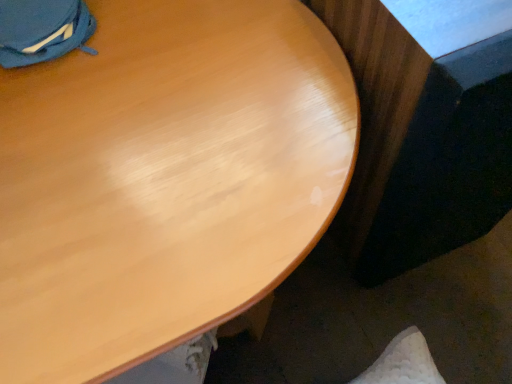
What is the approximate width of glossy wood desk at upper center?

The width of glossy wood desk at upper center is 24.34 inches.

Measure the distance between glossy wood desk at upper center and camera.

glossy wood desk at upper center and camera are 15.24 inches apart.

The height and width of the screenshot is (384, 512). Identify the location of glossy wood desk at upper center. (164, 179).

What do you see at coordinates (164, 179) in the screenshot?
I see `glossy wood desk at upper center` at bounding box center [164, 179].

Describe the element at coordinates (424, 128) in the screenshot. I see `glossy wood table at lower right` at that location.

Locate an element on the screen. The image size is (512, 384). glossy wood table at lower right is located at coordinates (424, 128).

Find the location of a particular element. glossy wood desk at upper center is located at coordinates point(164,179).

Does glossy wood desk at upper center appear on the left side of glossy wood table at lower right?

Yes, glossy wood desk at upper center is to the left of glossy wood table at lower right.

Considering the positions of objects glossy wood desk at upper center and glossy wood table at lower right in the image provided, who is in front, glossy wood desk at upper center or glossy wood table at lower right?

Positioned in front is glossy wood desk at upper center.

Does point (316, 136) come behind point (495, 73)?

Yes, point (316, 136) is farther from viewer.

From the picture: From the image's perspective, is glossy wood desk at upper center located above or below glossy wood table at lower right?

glossy wood desk at upper center is below glossy wood table at lower right.

From a real-world perspective, which object stands above the other?

glossy wood table at lower right, from a real-world perspective.

Which of these two, glossy wood desk at upper center or glossy wood table at lower right, is wider?

glossy wood desk at upper center.

Considering the sizes of objects glossy wood desk at upper center and glossy wood table at lower right in the image provided, who is shorter, glossy wood desk at upper center or glossy wood table at lower right?

glossy wood desk at upper center.

Considering the sizes of glossy wood desk at upper center and glossy wood table at lower right in the image, is glossy wood desk at upper center bigger or smaller than glossy wood table at lower right?

In the image, glossy wood desk at upper center appears to be larger than glossy wood table at lower right.

Looking at this image, which is correct: glossy wood desk at upper center is inside glossy wood table at lower right, or outside of it?

glossy wood desk at upper center is located beyond the bounds of glossy wood table at lower right.

Is glossy wood desk at upper center with glossy wood table at lower right?

glossy wood desk at upper center and glossy wood table at lower right are not in contact.

Is glossy wood desk at upper center facing away from glossy wood table at lower right?

That's not correct — glossy wood desk at upper center is not looking away from glossy wood table at lower right.

Looking at this image, how much distance is there between glossy wood desk at upper center and glossy wood table at lower right?

8.99 inches.

Identify the location of table above the glossy wood desk at upper center (from a real-world perspective). The height and width of the screenshot is (384, 512). (424, 128).

Considering the relative positions of glossy wood table at lower right and glossy wood desk at upper center in the image provided, is glossy wood table at lower right to the left of glossy wood desk at upper center from the viewer's perspective?

Incorrect, glossy wood table at lower right is not on the left side of glossy wood desk at upper center.

Considering the positions of objects glossy wood table at lower right and glossy wood desk at upper center in the image provided, who is in front, glossy wood table at lower right or glossy wood desk at upper center?

Positioned in front is glossy wood desk at upper center.

Is point (488, 80) farther from viewer compared to point (230, 230)?

No, it is in front of (230, 230).

From the image's perspective, between glossy wood table at lower right and glossy wood desk at upper center, who is located below?

glossy wood desk at upper center.

From a real-world perspective, is glossy wood table at lower right above or below glossy wood desk at upper center?

From a real-world perspective, glossy wood table at lower right is physically above glossy wood desk at upper center.

Considering the relative sizes of glossy wood table at lower right and glossy wood desk at upper center in the image provided, is glossy wood table at lower right thinner than glossy wood desk at upper center?

Yes, glossy wood table at lower right is thinner than glossy wood desk at upper center.

Does glossy wood table at lower right have a greater height compared to glossy wood desk at upper center?

Yes.

Considering the relative sizes of glossy wood table at lower right and glossy wood desk at upper center in the image provided, is glossy wood table at lower right bigger than glossy wood desk at upper center?

Actually, glossy wood table at lower right might be smaller than glossy wood desk at upper center.

Is glossy wood desk at upper center surrounded by glossy wood table at lower right?

That's incorrect, glossy wood desk at upper center is not inside glossy wood table at lower right.

Is glossy wood table at lower right touching glossy wood desk at upper center?

No.

Is glossy wood table at lower right looking in the opposite direction of glossy wood desk at upper center?

No, glossy wood table at lower right's orientation is not away from glossy wood desk at upper center.

Identify the location of desk on the left of glossy wood table at lower right. This screenshot has width=512, height=384. (164, 179).

In order to click on table behind the glossy wood desk at upper center in this screenshot , I will do `click(424, 128)`.

Identify the location of desk on the left side of glossy wood table at lower right. (164, 179).